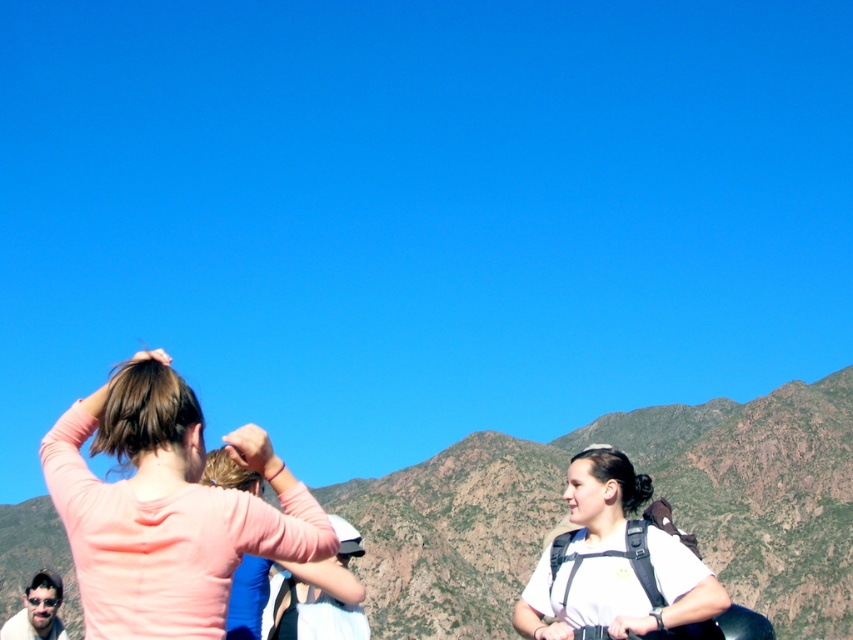
Can you confirm if green textured mountain at center is wider than white matte backpack at center?

Indeed, green textured mountain at center has a greater width compared to white matte backpack at center.

What are the coordinates of `green textured mountain at center` in the screenshot? It's located at point(656,493).

Is pink matte shirt at upper left wider than white matte backpack at center?

Correct, the width of pink matte shirt at upper left exceeds that of white matte backpack at center.

Between pink matte shirt at upper left and white matte backpack at center, which one appears on the right side from the viewer's perspective?

Positioned to the right is white matte backpack at center.

Is point (277, 532) positioned in front of point (599, 609)?

That is True.

Locate an element on the screen. This screenshot has height=640, width=853. pink matte shirt at upper left is located at coordinates (169, 520).

Between point (424, 513) and point (242, 435), which one is positioned behind?

Positioned behind is point (424, 513).

Who is taller, green textured mountain at center or pink matte shirt at upper left?

Standing taller between the two is green textured mountain at center.

Based on the photo, measure the distance between green textured mountain at center and camera.

green textured mountain at center is 99.64 meters away from camera.

Where is `green textured mountain at center`? green textured mountain at center is located at coordinates (656, 493).